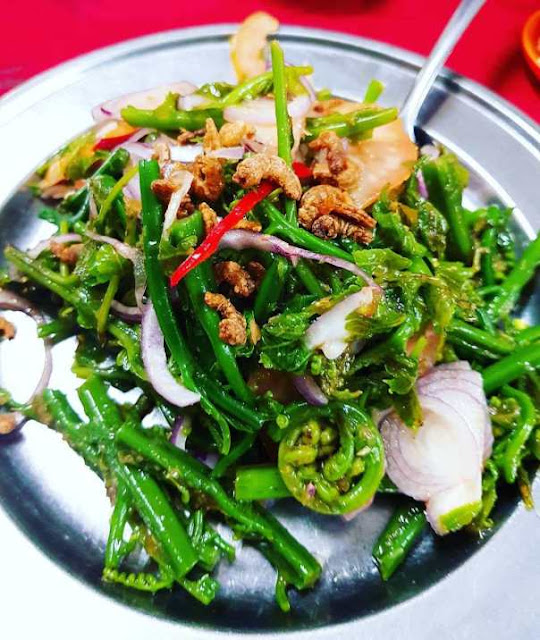
Find the location of a particular element. This screenshot has height=640, width=540. bottom of bowl is located at coordinates (345, 548).